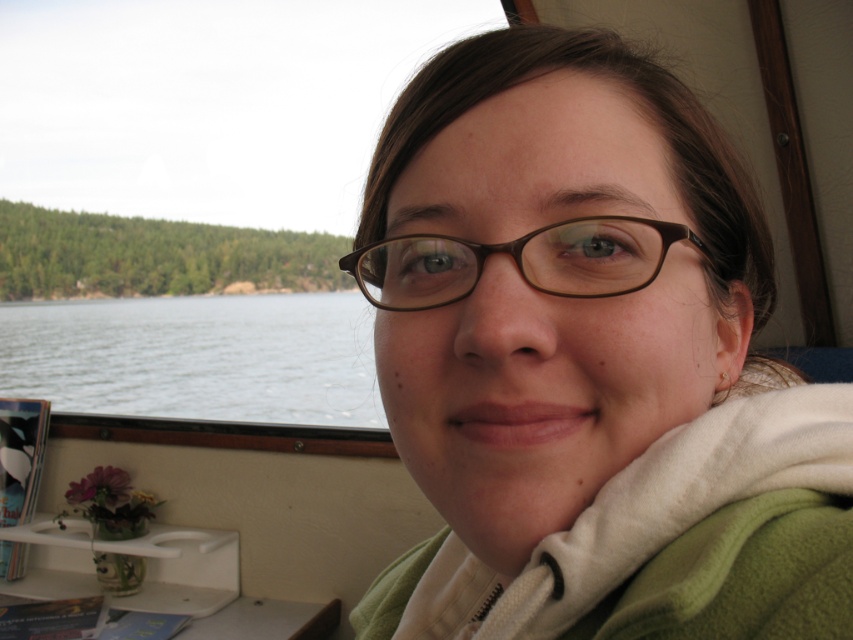
Looking at this image, can you confirm if clear water at window left is smaller than brown matte glasses at center?

No.

Locate an element on the screen. The height and width of the screenshot is (640, 853). clear water at window left is located at coordinates (196, 356).

Which is behind, point (10, 342) or point (619, 292)?

The point (10, 342) is behind.

Image resolution: width=853 pixels, height=640 pixels. I want to click on clear water at window left, so click(x=196, y=356).

How far apart are matte brown glasses at center and clear water at window left?

matte brown glasses at center and clear water at window left are 7.41 meters apart from each other.

In the scene shown: Can you confirm if matte brown glasses at center is wider than clear water at window left?

Indeed, matte brown glasses at center has a greater width compared to clear water at window left.

Measure the distance between point (381,598) and camera.

Point (381,598) and camera are 22.88 inches apart.

This screenshot has width=853, height=640. Identify the location of matte brown glasses at center. (590, 362).

Can you confirm if matte brown glasses at center is shorter than brown matte glasses at center?

No.

Between matte brown glasses at center and brown matte glasses at center, which one has less height?

brown matte glasses at center

Is point (693, 499) closer to viewer compared to point (437, 273)?

Yes, it is in front of point (437, 273).

In order to click on matte brown glasses at center in this screenshot , I will do `click(590, 362)`.